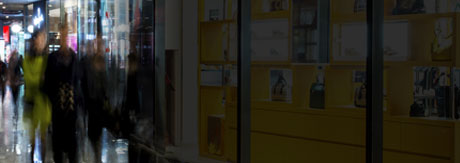
Where is `yellow wall`? This screenshot has width=460, height=163. yellow wall is located at coordinates (305, 130), (421, 152), (209, 100).